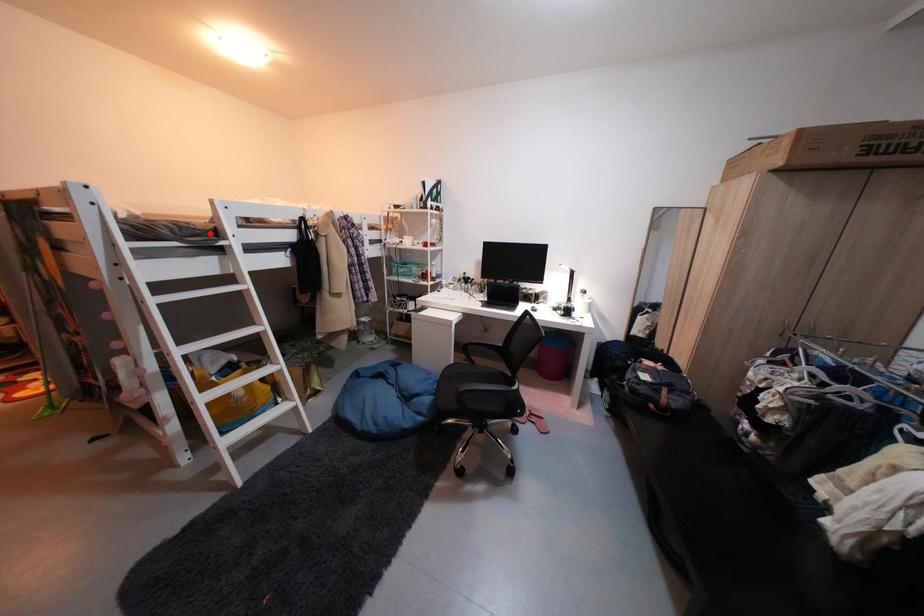
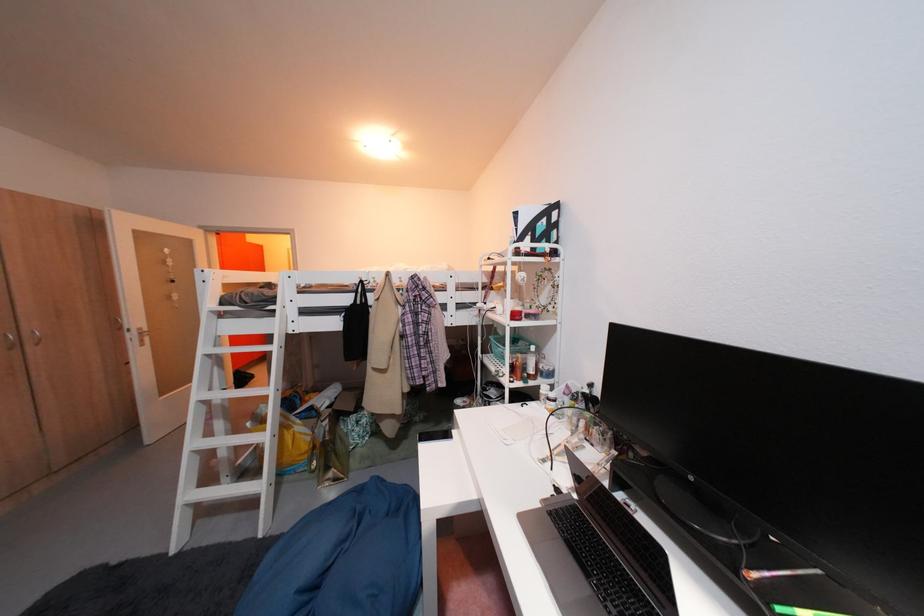
The point at the highlighted location is marked in the first image. Where is the corresponding point in the second image?

(276, 300)